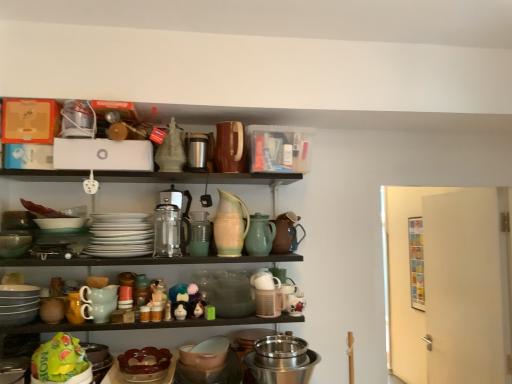
Question: Is matte white figurine at center, arranged as the second toy when viewed from the left, thinner than brown glossy cake stand at lower center, which is the fourth tableware from right to left?

Choices:
 (A) no
 (B) yes

Answer: (B)

Question: Considering the relative positions of matte white figurine at center, arranged as the second toy when viewed from the left, and brown glossy cake stand at lower center, which is the fourth tableware from right to left, in the image provided, is matte white figurine at center, arranged as the second toy when viewed from the left, to the left of brown glossy cake stand at lower center, which is the fourth tableware from right to left, from the viewer's perspective?

Choices:
 (A) yes
 (B) no

Answer: (B)

Question: Is matte white figurine at center, which is the second toy from right to left, smaller than brown glossy cake stand at lower center, which appears as the fourth tableware when viewed from the left?

Choices:
 (A) no
 (B) yes

Answer: (B)

Question: From the image's perspective, does matte white figurine at center, arranged as the second toy when viewed from the left, appear lower than brown glossy cake stand at lower center, which appears as the fourth tableware when viewed from the left?

Choices:
 (A) no
 (B) yes

Answer: (A)

Question: Is matte white figurine at center, arranged as the second toy when viewed from the left, surrounding brown glossy cake stand at lower center, which is the fourth tableware from right to left?

Choices:
 (A) yes
 (B) no

Answer: (B)

Question: Is clear glass coffee maker at center situated inside matte ceramic mugs at center, which is the second tableware from left to right, or outside?

Choices:
 (A) inside
 (B) outside

Answer: (B)

Question: From a real-world perspective, is clear glass coffee maker at center physically located above or below matte ceramic mugs at center, which is the second tableware from left to right?

Choices:
 (A) above
 (B) below

Answer: (A)

Question: Visually, is clear glass coffee maker at center positioned to the left or to the right of matte ceramic mugs at center, which is counted as the sixth tableware, starting from the right?

Choices:
 (A) right
 (B) left

Answer: (A)

Question: From their relative heights in the image, would you say clear glass coffee maker at center is taller or shorter than matte ceramic mugs at center, which is the second tableware from left to right?

Choices:
 (A) short
 (B) tall

Answer: (B)

Question: In the image, is speckled ceramic pitcher at center, which appears as the 3th tableware when viewed from the right, positioned in front of or behind matte plastic toy at center, the 1th toy when ordered from right to left?

Choices:
 (A) front
 (B) behind

Answer: (B)

Question: From a real-world perspective, is speckled ceramic pitcher at center, which appears as the 3th tableware when viewed from the right, above or below matte plastic toy at center, which is counted as the 3th toy, starting from the left?

Choices:
 (A) above
 (B) below

Answer: (A)

Question: From the image's perspective, is speckled ceramic pitcher at center, the fifth tableware in the left-to-right sequence, above or below matte plastic toy at center, which is counted as the 3th toy, starting from the left?

Choices:
 (A) above
 (B) below

Answer: (A)

Question: Considering the positions of speckled ceramic pitcher at center, the fifth tableware in the left-to-right sequence, and matte plastic toy at center, the 1th toy when ordered from right to left, in the image, is speckled ceramic pitcher at center, the fifth tableware in the left-to-right sequence, wider or thinner than matte plastic toy at center, the 1th toy when ordered from right to left,?

Choices:
 (A) thin
 (B) wide

Answer: (B)

Question: Is brown glossy cake stand at lower center, which appears as the fourth tableware when viewed from the left, in front of or behind white glossy plates at center, the fifth tableware in the right-to-left sequence, in the image?

Choices:
 (A) behind
 (B) front

Answer: (B)

Question: Is brown glossy cake stand at lower center, which is the fourth tableware from right to left, inside or outside of white glossy plates at center, arranged as the third tableware when viewed from the left?

Choices:
 (A) inside
 (B) outside

Answer: (B)